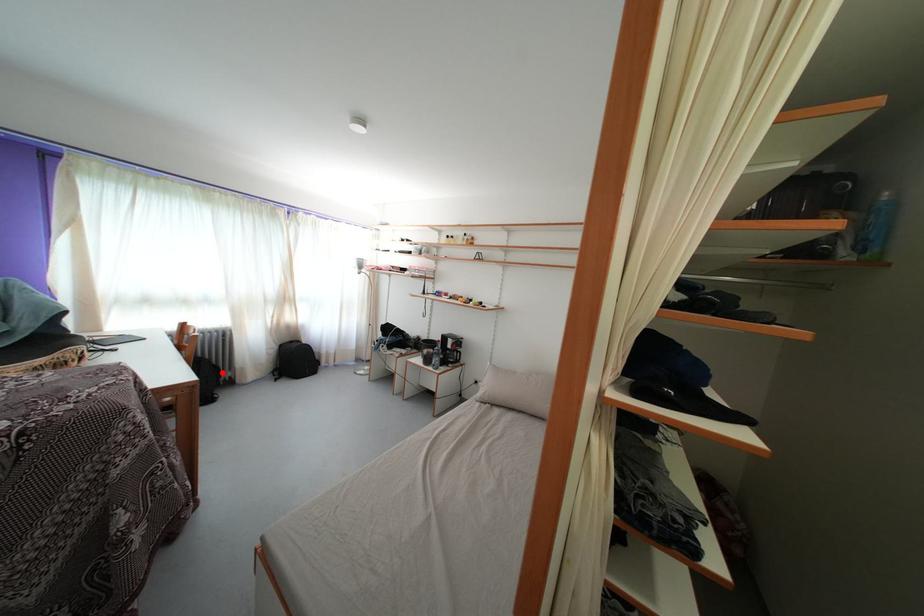
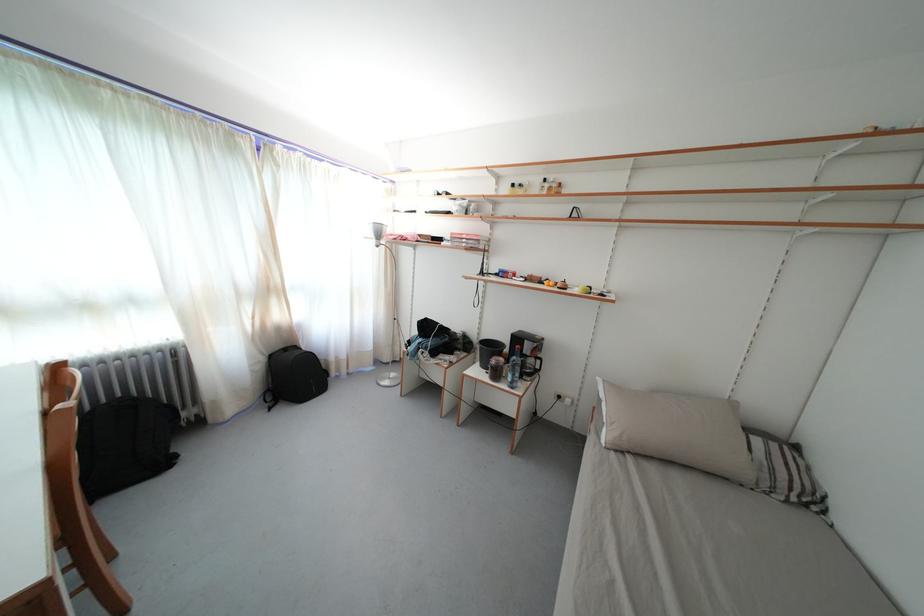
Question: I am providing you with two images of the same scene from different viewpoints. Given a red point in image1, look at the same physical point in image2. Is it:

Choices:
 (A) Closer to the viewpoint
 (B) Farther from the viewpoint

Answer: (B)